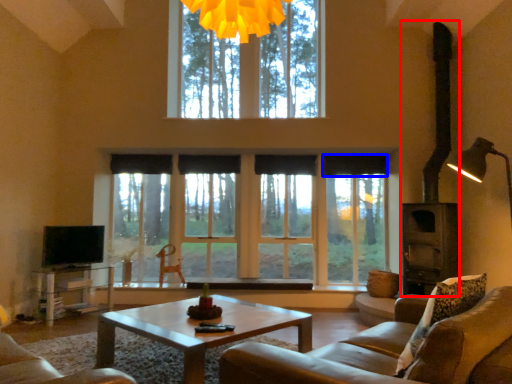
Question: Which object appears closest to the camera in this image, fireplace (highlighted by a red box) or curtain (highlighted by a blue box)?

Choices:
 (A) fireplace
 (B) curtain

Answer: (A)